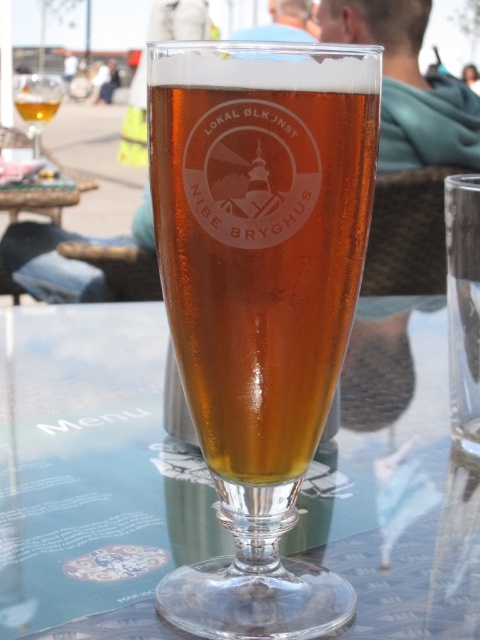
Question: Among these points, which one is farthest from the camera?

Choices:
 (A) click(60, 83)
 (B) click(28, 108)
 (C) click(189, 561)
 (D) click(287, 401)

Answer: (B)

Question: Is translucent glass beer glass at center positioned at the back of amber glass beer at center?

Choices:
 (A) no
 (B) yes

Answer: (A)

Question: Considering the relative positions of translucent glass wine at upper left and amber glass beer at center in the image provided, where is translucent glass wine at upper left located with respect to amber glass beer at center?

Choices:
 (A) below
 (B) above

Answer: (A)

Question: Which object is the farthest from the transparent glass table at center?

Choices:
 (A) translucent glass beer glass at center
 (B) translucent glass wine at upper left
 (C) amber glass beer at center

Answer: (C)

Question: Is transparent glass table at center wider than amber glass beer at center?

Choices:
 (A) no
 (B) yes

Answer: (B)

Question: Which object is closer to the camera taking this photo?

Choices:
 (A) translucent glass beer glass at center
 (B) translucent glass wine at upper left
 (C) transparent glass table at center

Answer: (A)